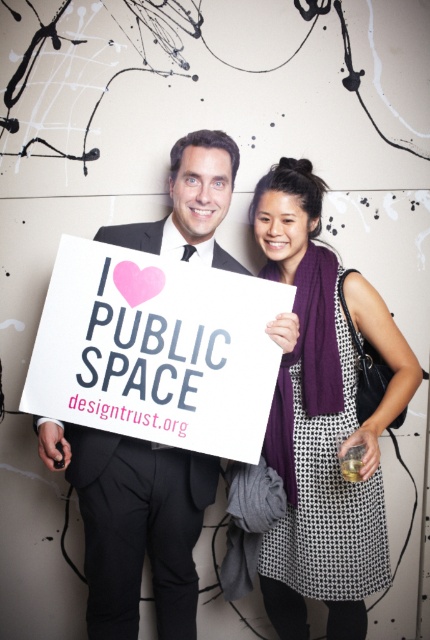
Between point (86, 316) and point (154, 228), which one is positioned behind?

The point (154, 228) is behind.

Who is taller, white paper sign at center or black matte suit at center?

black matte suit at center

Is point (184, 369) more distant than point (174, 205)?

No, it is not.

This screenshot has height=640, width=430. Find the location of `white paper sign at center`. white paper sign at center is located at coordinates (156, 349).

Does purple knitted scarf at upper right appear on the right side of white paper sign at center?

Indeed, purple knitted scarf at upper right is positioned on the right side of white paper sign at center.

Is point (341, 388) positioned after point (103, 428)?

That is True.

Image resolution: width=430 pixels, height=640 pixels. I want to click on purple knitted scarf at upper right, so click(x=322, y=419).

Measure the distance from purple knitted scarf at upper right to black matte suit at center.

The distance of purple knitted scarf at upper right from black matte suit at center is 16.69 inches.

Does purple knitted scarf at upper right have a greater width compared to black matte suit at center?

Correct, the width of purple knitted scarf at upper right exceeds that of black matte suit at center.

Who is more distant from viewer, (323,401) or (135,518)?

Positioned behind is point (135,518).

You are a GUI agent. You are given a task and a screenshot of the screen. Output one action in this format:
    pyautogui.click(x=<x>, y=<y>)
    Task: Click on the purple knitted scarf at upper right
    
    Given the screenshot: What is the action you would take?
    pyautogui.click(x=322, y=419)